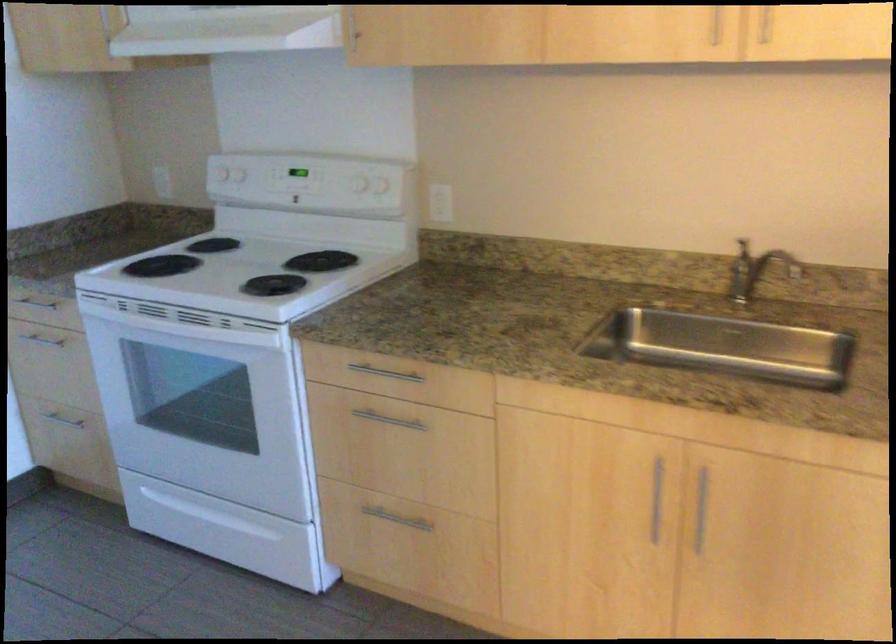
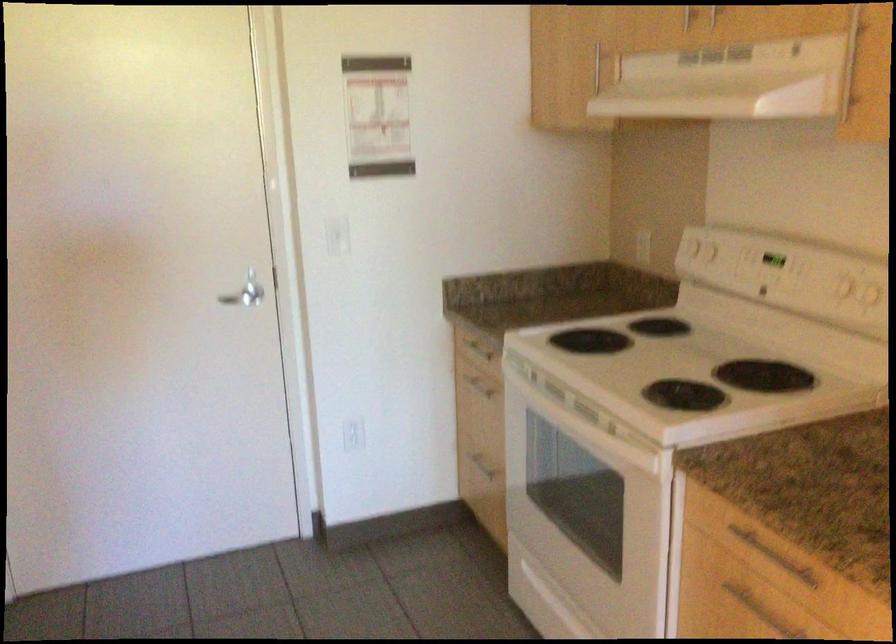
Question: The camera is either moving clockwise (left) or counter-clockwise (right) around the object. The first image is from the beginning of the video and the second image is from the end. Is the camera moving left or right when shooting the video?

Choices:
 (A) Left
 (B) Right

Answer: (B)